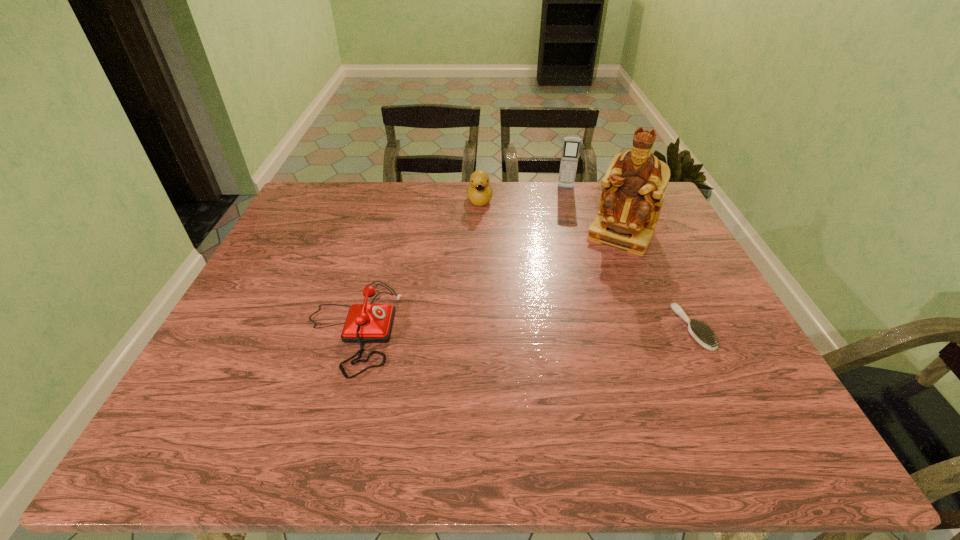
Where is `telephone`? Image resolution: width=960 pixels, height=540 pixels. telephone is located at coordinates (366, 323).

You are a GUI agent. You are given a task and a screenshot of the screen. Output one action in this format:
    pyautogui.click(x=<x>, y=<y>)
    Task: Click on the second shortest object
    
    Given the screenshot: What is the action you would take?
    pyautogui.click(x=366, y=323)

Locate an element on the screen. scrubbing brush is located at coordinates (703, 335).

I want to click on figurine, so click(x=633, y=188).

Locate an element on the screen. the third farthest object is located at coordinates (633, 188).

This screenshot has height=540, width=960. Identify the location of duckling. (479, 193).

This screenshot has height=540, width=960. Find the location of `the second object from left to right`. the second object from left to right is located at coordinates (479, 193).

What are the coordinates of `the fourth shortest object` in the screenshot? It's located at (571, 146).

Identify the location of free space located on the dial of the fourth tallest object. This screenshot has height=540, width=960. (540, 327).

Find the location of `vacant space situated 0.380m on the back of the scrubbing brush`. vacant space situated 0.380m on the back of the scrubbing brush is located at coordinates (640, 219).